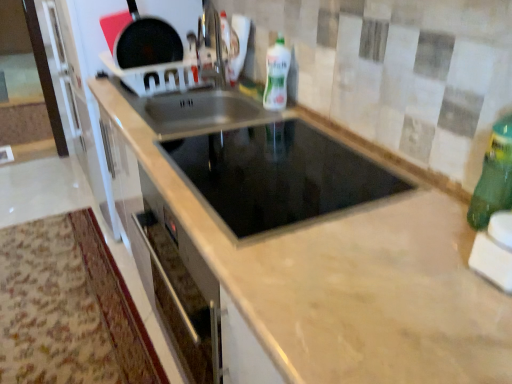
Question: Considering the relative positions of black glass cooktop at center and white glossy bottle at upper center, arranged as the 2th bottle when viewed from the front, in the image provided, is black glass cooktop at center to the left or to the right of white glossy bottle at upper center, arranged as the 2th bottle when viewed from the front,?

Choices:
 (A) right
 (B) left

Answer: (B)

Question: From the image's perspective, is black glass cooktop at center located above or below white glossy bottle at upper center, marked as the first bottle in a back-to-front arrangement?

Choices:
 (A) below
 (B) above

Answer: (A)

Question: Estimate the real-world distances between objects in this image. Which object is farther from the beige marble countertop at center?

Choices:
 (A) green plastic bottle at right, positioned as the 2th bottle in back-to-front order
 (B) black glass cooktop at center
 (C) white glossy bottle at upper center, which is counted as the first bottle, starting from the left
 (D) shiny black frying pan at upper left

Answer: (D)

Question: Which is farther from the white glossy bottle at upper center, the first bottle from the top?

Choices:
 (A) beige marble countertop at center
 (B) black glass cooktop at center
 (C) green plastic bottle at right, positioned as the 2th bottle in back-to-front order
 (D) shiny black frying pan at upper left

Answer: (C)